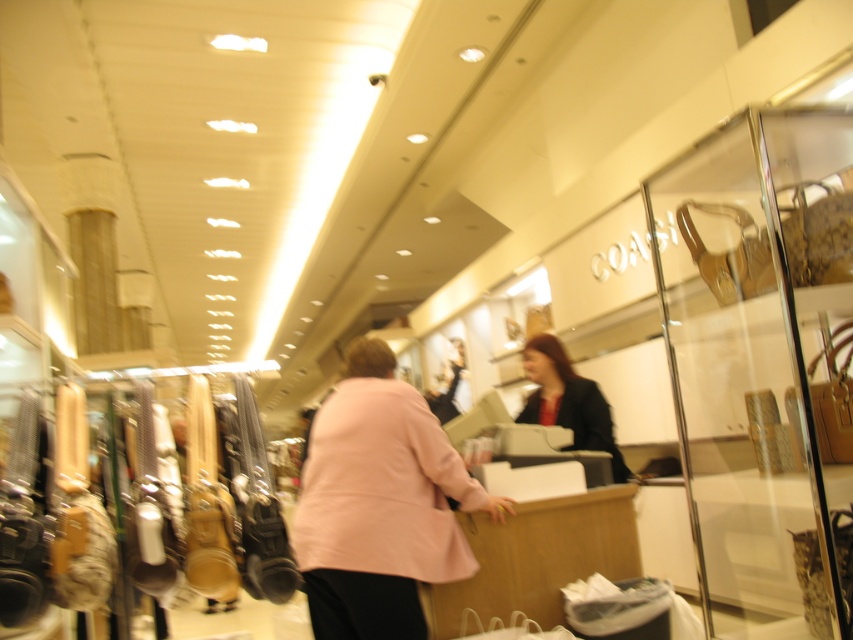
Question: Can you confirm if pink fabric coat at center is smaller than dark blue fabric jacket at center?

Choices:
 (A) no
 (B) yes

Answer: (A)

Question: Which object is closer to the camera taking this photo?

Choices:
 (A) pink fabric coat at center
 (B) dark blue fabric jacket at center

Answer: (A)

Question: Can you confirm if pink fabric coat at center is positioned to the right of dark blue fabric jacket at center?

Choices:
 (A) yes
 (B) no

Answer: (B)

Question: Which of the following is the farthest from the observer?

Choices:
 (A) (560, 419)
 (B) (489, 499)

Answer: (A)

Question: Among these objects, which one is nearest to the camera?

Choices:
 (A) dark blue fabric jacket at center
 (B) pink fabric coat at center

Answer: (B)

Question: Is pink fabric coat at center thinner than dark blue fabric jacket at center?

Choices:
 (A) no
 (B) yes

Answer: (A)